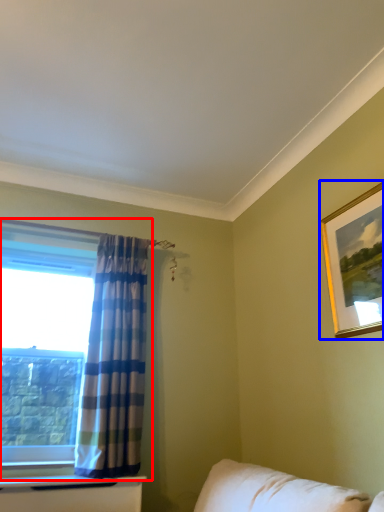
Question: Which of the following is the closest to the observer, window (highlighted by a red box) or picture frame (highlighted by a blue box)?

Choices:
 (A) window
 (B) picture frame

Answer: (B)